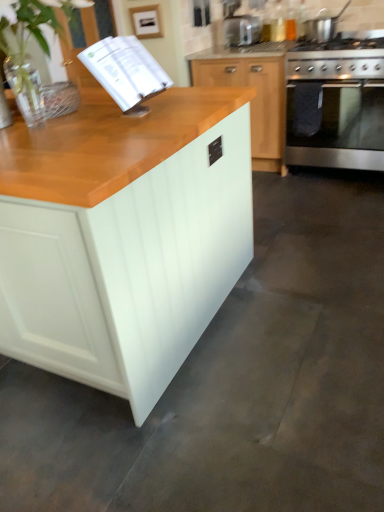
This screenshot has width=384, height=512. What are the coordinates of `vacant area situated to the left side of white paper book at upper left` in the screenshot? It's located at (76, 125).